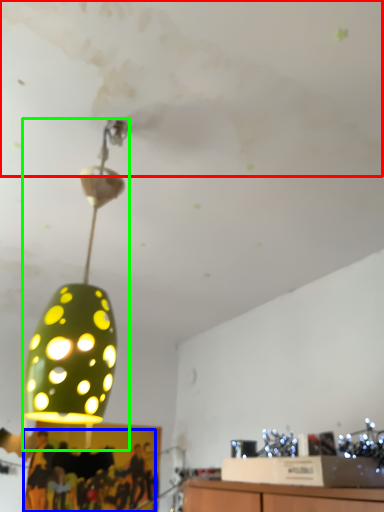
Question: Which object is positioned farthest from cloud (highlighted by a red box)? Select from person (highlighted by a blue box) and lamp (highlighted by a green box).

Choices:
 (A) person
 (B) lamp

Answer: (A)